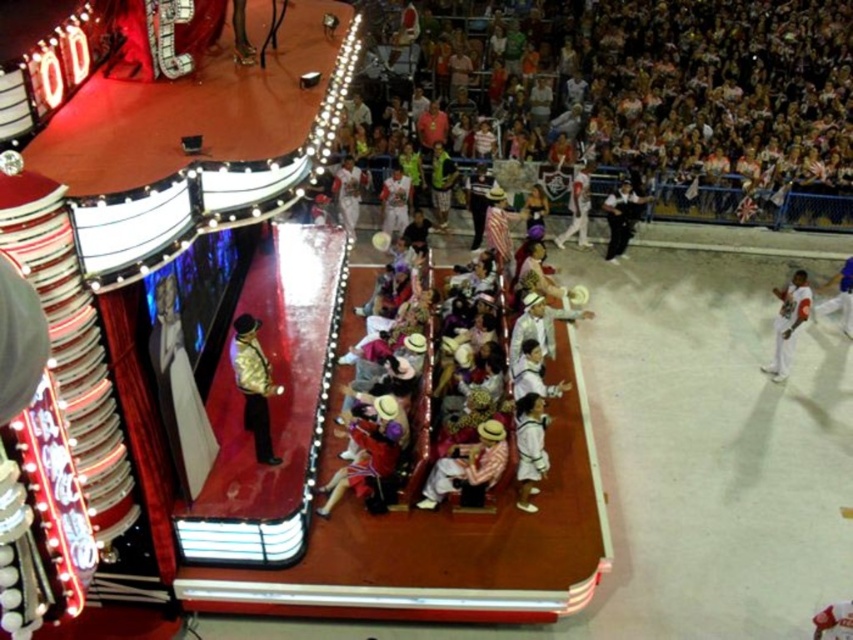
You are a stagehand who needs to adjust the lighting to focus on the performer wearing the white cotton dress at center and the performer wearing the white cotton pants at center. Since both are white, how can you tell which one is closer to the front of the stage?

The white cotton dress at center is in front of the white cotton pants at center, so the dress is closer to the front of the stage.

You are an audience member sitting in the front row of the circus performance. You notice two white items on the stage. The first is the white baseball uniform at right, and the second is the white cotton shirt at upper right. Which of these items is located lower on the stage?

The white baseball uniform at right is positioned under the white cotton shirt at upper right, so it is located lower on the stage.